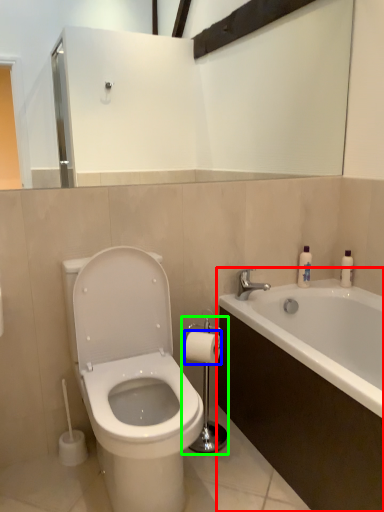
Question: Which object is positioned closest to bathtub (highlighted by a red box)? Select from toilet paper (highlighted by a blue box) and towel bar (highlighted by a green box).

Choices:
 (A) toilet paper
 (B) towel bar

Answer: (B)